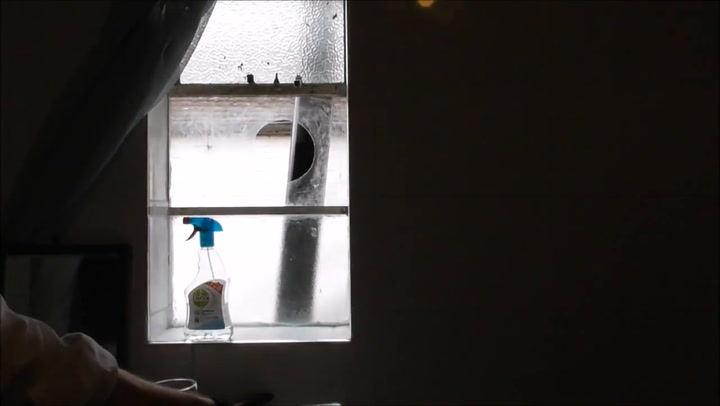
The image size is (720, 406). What are the coordinates of `gray window sill` in the screenshot? It's located at (299, 333).